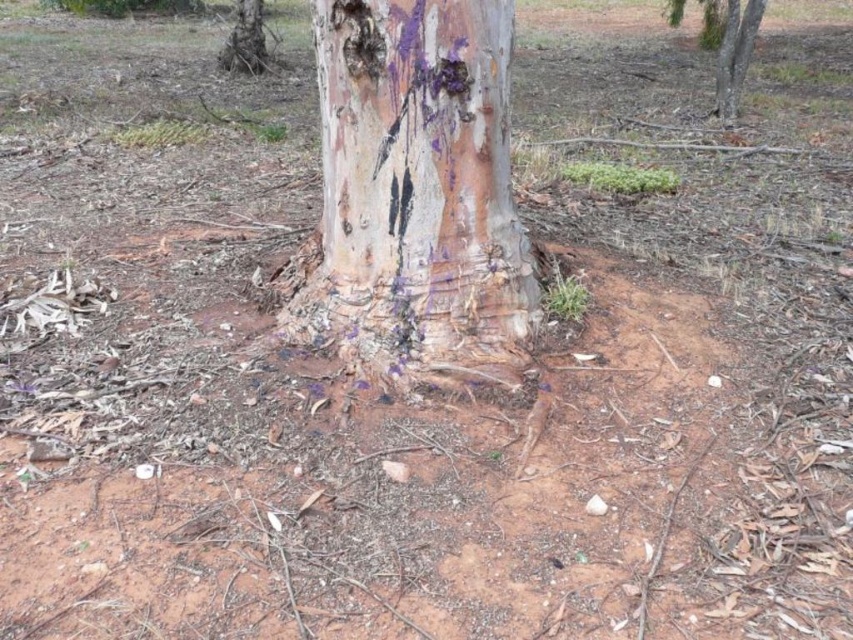
You are standing in front of the tree and want to mark the exact center of the smooth bark tree trunk at center. According to the coordinates provided, where should you place your mark?

The exact center of the smooth bark tree trunk at center should be marked at the coordinates point (415,196).

You are a park ranger measuring the distance between two purple rough bark areas on a tree trunk. The tree trunk is in a dry open area. You have a measuring tape that can extend up to 5 meters. Can you measure the distance between the purple rough bark at upper right and the purple rough bark at upper left without needing to extend the tape beyond its limit?

The distance between the purple rough bark at upper right and the purple rough bark at upper left is 6.25 meters. Since the measuring tape can only extend up to 5 meters, you cannot measure the full distance without extending beyond its limit.